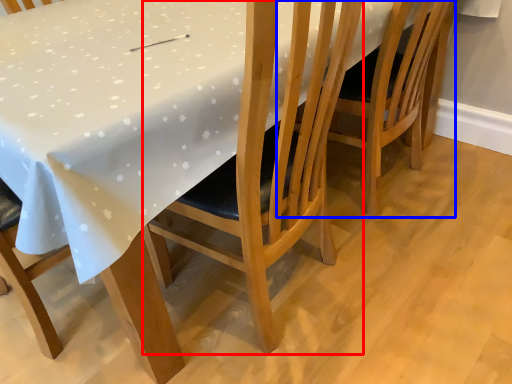
Question: Which object appears closest to the camera in this image, chair (highlighted by a red box) or chair (highlighted by a blue box)?

Choices:
 (A) chair
 (B) chair

Answer: (A)